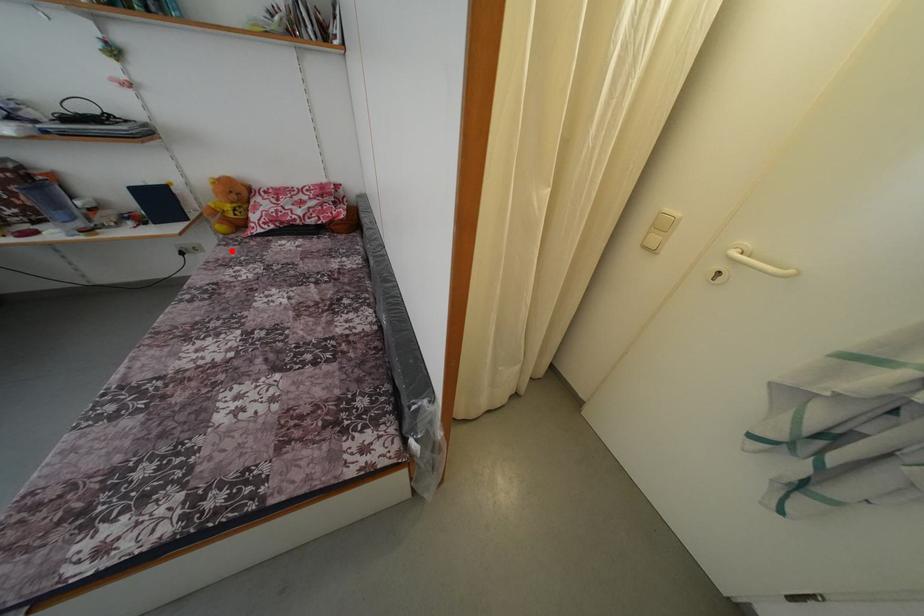
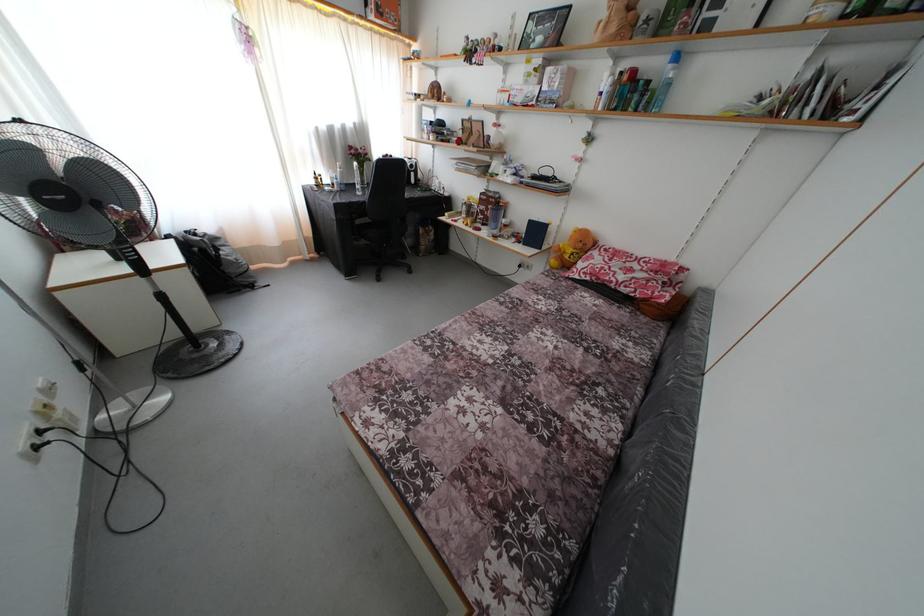
Where in the second image is the point corresponding to the highlighted location from the first image?

(552, 282)